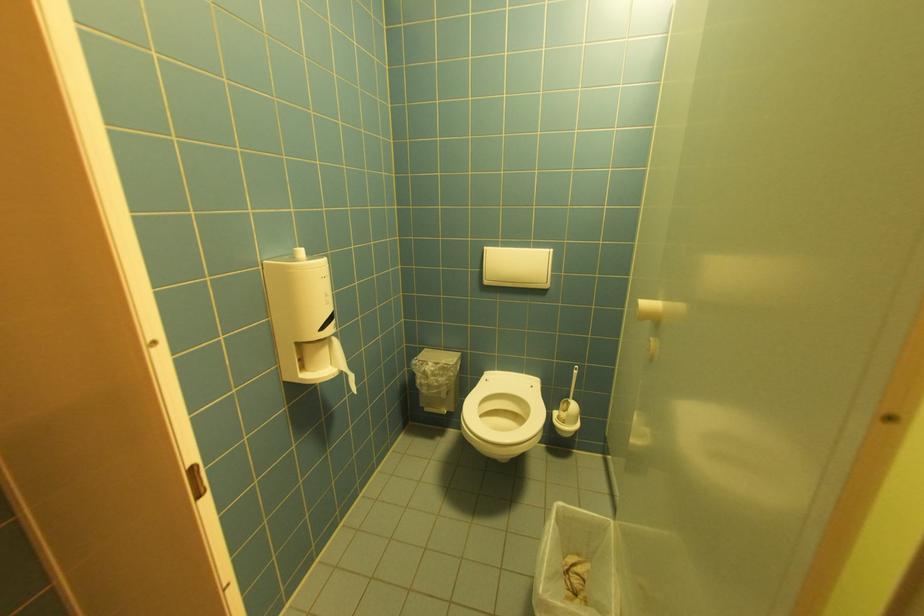
What do you see at coordinates (504, 414) in the screenshot?
I see `a white toilet seat` at bounding box center [504, 414].